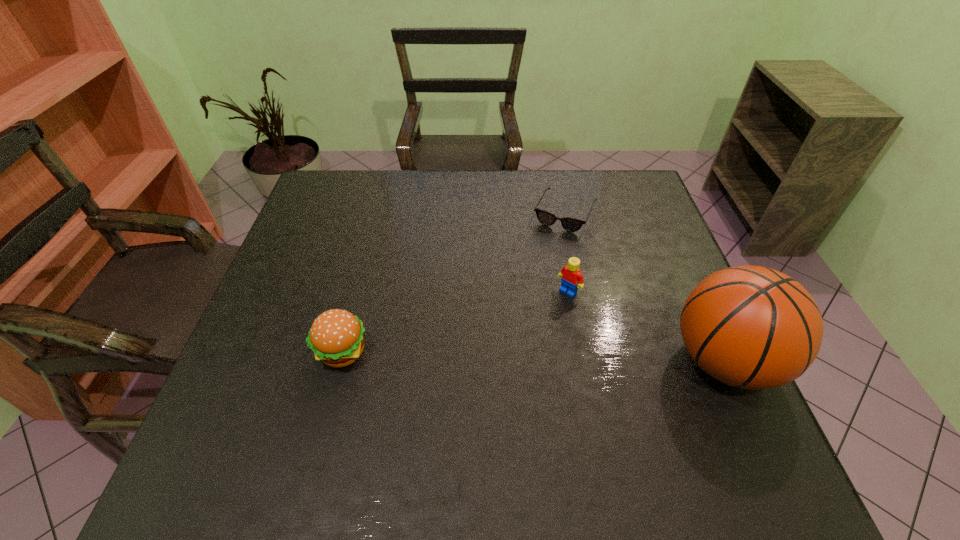
Where is `vacant space on the desktop that is between the leftmost object and the tallest object and is positioned on the front lenses of the shortest object`? vacant space on the desktop that is between the leftmost object and the tallest object and is positioned on the front lenses of the shortest object is located at coordinates (494, 355).

At what (x,y) coordinates should I click in order to perform the action: click on free spot on the desktop that is between the hamburger and the tallest object and is positioned on the face of the Lego. Please return your answer as a coordinate pair (x, y). Image resolution: width=960 pixels, height=540 pixels. Looking at the image, I should click on (507, 356).